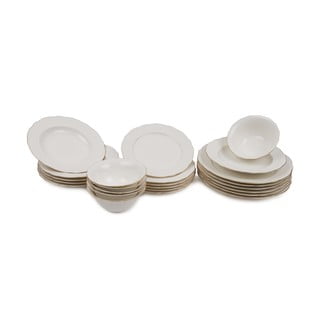
Find the location of a particular element. This screenshot has height=320, width=320. dishes in first stack from the left is located at coordinates (44, 157), (64, 175), (73, 180), (68, 184), (63, 185).